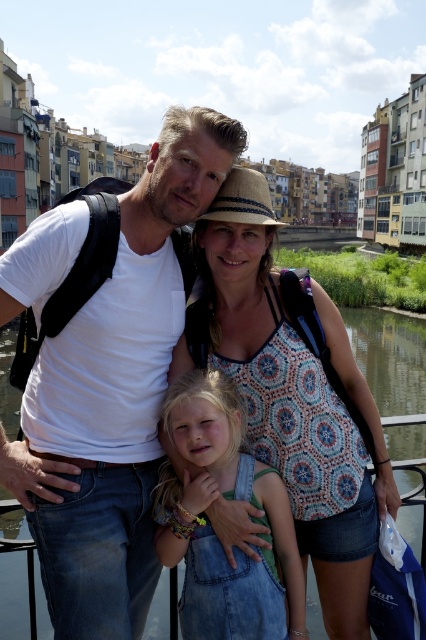
Question: Estimate the real-world distances between objects in this image. Which object is farther from the white matte t-shirt at center?

Choices:
 (A) green water at center
 (B) patterned fabric tank top at center

Answer: (A)

Question: Is patterned fabric tank top at center thinner than denim overalls at center?

Choices:
 (A) yes
 (B) no

Answer: (B)

Question: Can you confirm if white matte t-shirt at center is thinner than green water at center?

Choices:
 (A) no
 (B) yes

Answer: (B)

Question: In this image, where is patterned fabric tank top at center located relative to denim overalls at center?

Choices:
 (A) right
 (B) left

Answer: (A)

Question: Which point appears farthest from the camera in this image?

Choices:
 (A) (164, 586)
 (B) (187, 522)

Answer: (A)

Question: Which point is farther to the camera?

Choices:
 (A) (385, 435)
 (B) (210, 563)

Answer: (A)